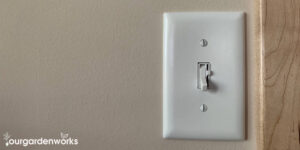
Locate an element on the screen. top right corner of switchplate is located at coordinates (242, 13).